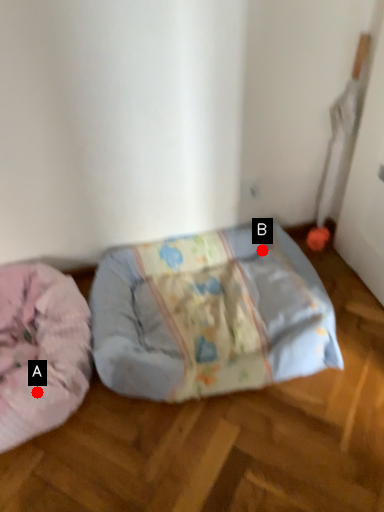
Question: Two points are circled on the image, labeled by A and B beside each circle. Which point is farther to the camera?

Choices:
 (A) A is further
 (B) B is further

Answer: (B)